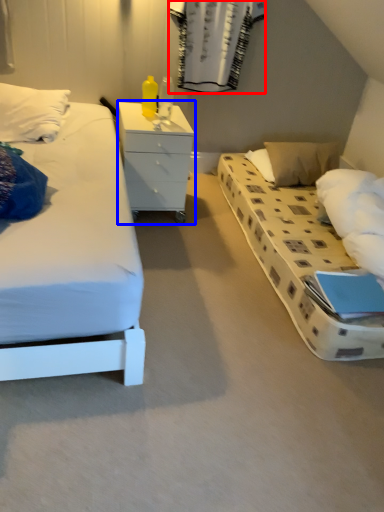
Question: Which object appears closest to the camera in this image, curtain (highlighted by a red box) or chest of drawers (highlighted by a blue box)?

Choices:
 (A) curtain
 (B) chest of drawers

Answer: (B)